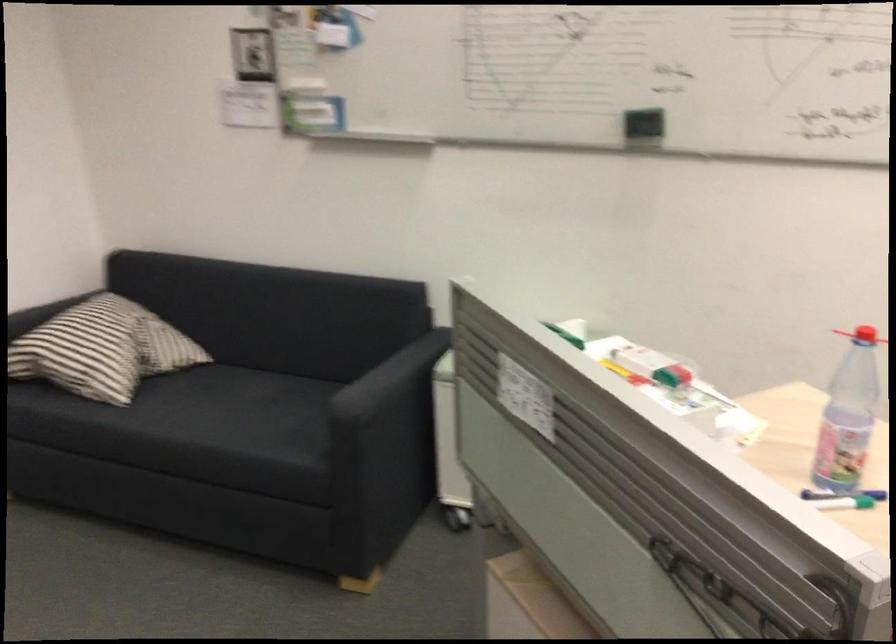
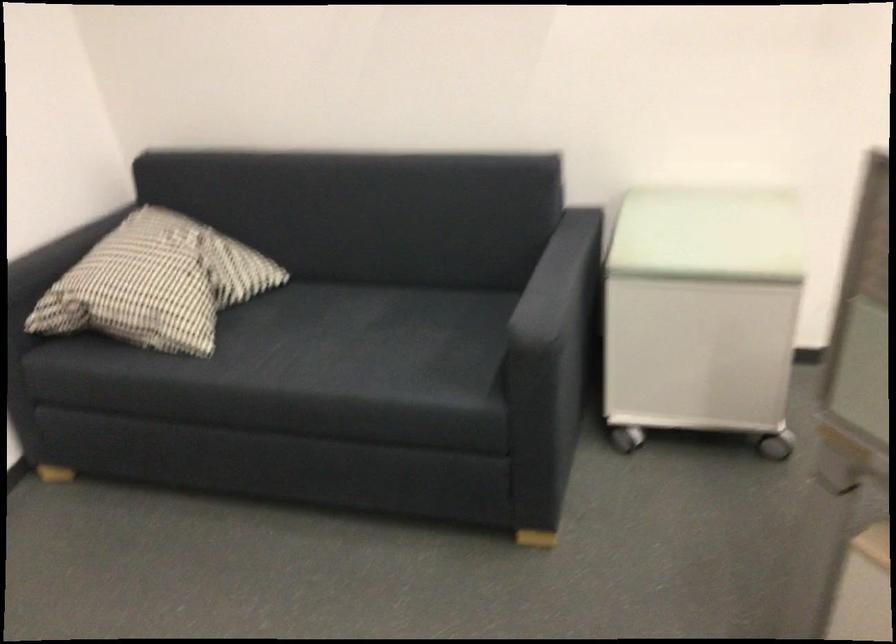
Locate, in the second image, the point that corresponds to (x=92, y=346) in the first image.

(156, 283)